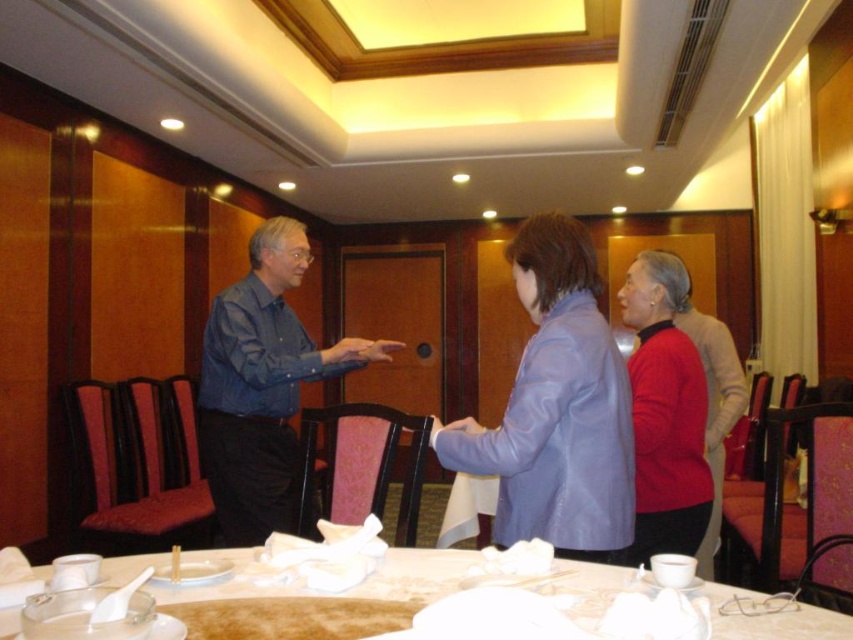
Question: Among these points, which one is nearest to the camera?

Choices:
 (A) (379, 360)
 (B) (293, 592)

Answer: (B)

Question: Which object is closer to the camera taking this photo?

Choices:
 (A) white fabric table at lower center
 (B) purple leather jacket at center
 (C) blue shirt at center
 (D) matte red sweater at center

Answer: (A)

Question: Considering the real-world distances, which object is farthest from the white fabric table at lower center?

Choices:
 (A) matte red sweater at center
 (B) purple leather jacket at center

Answer: (B)

Question: Does matte red sweater at center lie behind purple leather jacket at center?

Choices:
 (A) no
 (B) yes

Answer: (A)

Question: Can you confirm if white fabric table at lower center is positioned to the left of purple leather jacket at center?

Choices:
 (A) yes
 (B) no

Answer: (A)

Question: Does blue shirt at center have a greater width compared to white fabric table at lower center?

Choices:
 (A) no
 (B) yes

Answer: (A)